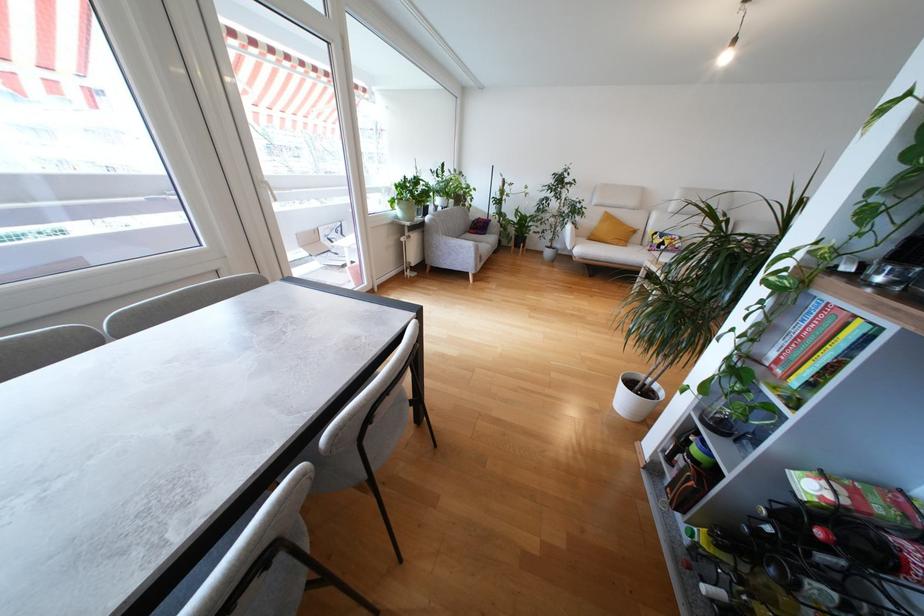
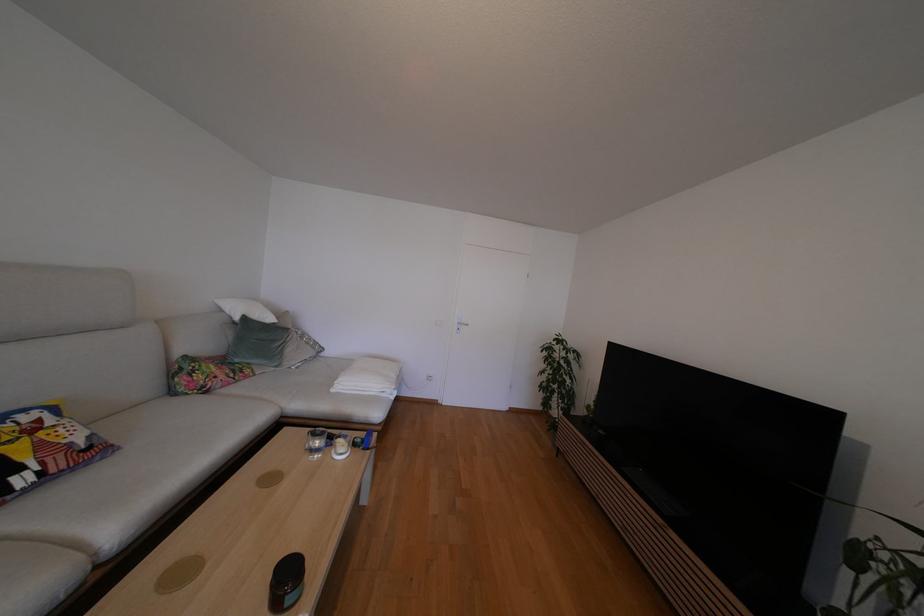
Question: I am providing you with two images of the same scene from different viewpoints. After the viewpoint changes to image2, which objects are now occluded?

Choices:
 (A) patterned pillow
 (B) white pillow
 (C) silver door handle
 (D) none of these

Answer: (D)